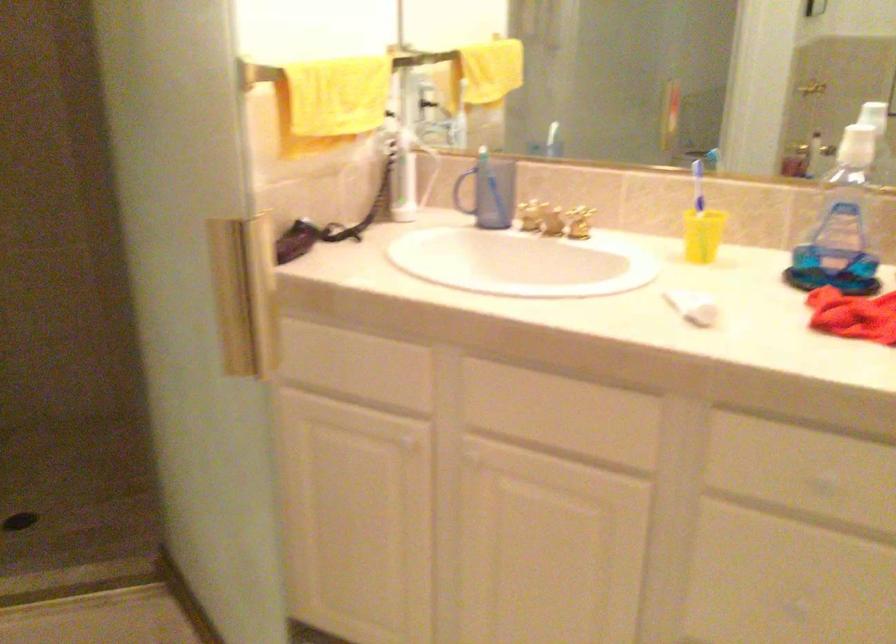
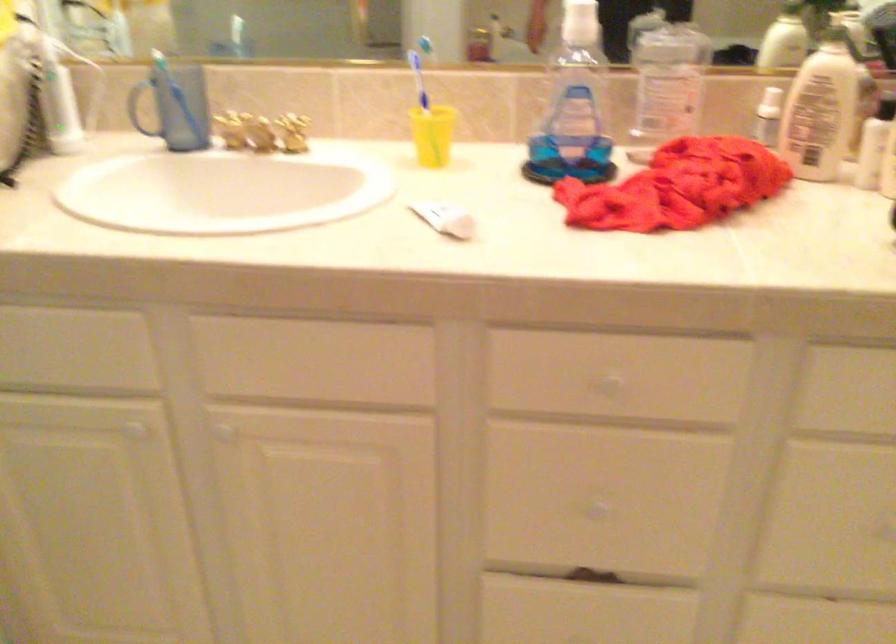
Locate, in the second image, the point that corresponds to (x=698, y=234) in the first image.

(432, 135)